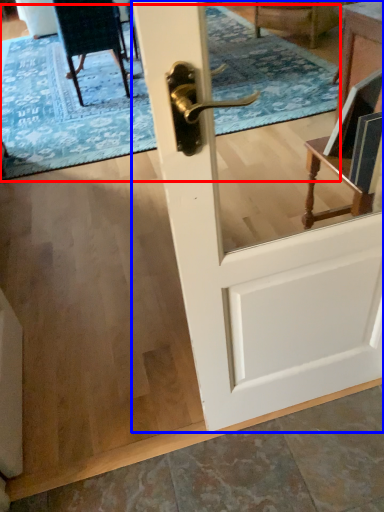
Question: Which object appears closest to the camera in this image, doormat (highlighted by a red box) or door (highlighted by a blue box)?

Choices:
 (A) doormat
 (B) door

Answer: (B)